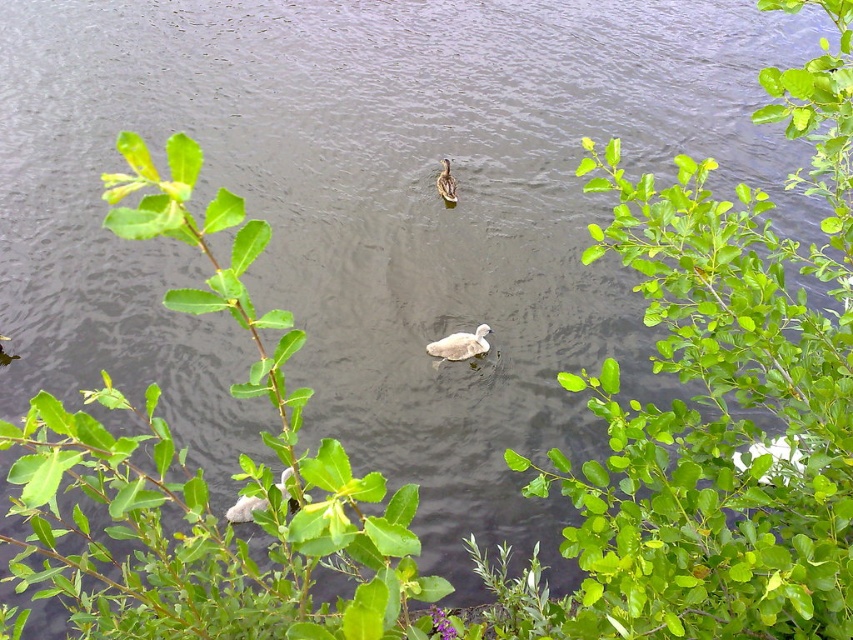
You are standing at the edge of the lake and want to place a small decorative rock exactly at the center of the green leafy plant at center. According to the coordinates provided, where should you place the rock?

The green leafy plant at center is located at point [204,480], so you should place the rock at those coordinates to position it exactly at the center of the plant.

You are a photographer trying to capture a closeup of the white fluffy swan at center without the green leafy plant at center blocking the view. Based on their sizes, can you position yourself in a way that the swan is fully visible without the plant overlapping?

The green leafy plant at center is wider than the white fluffy swan at center. To avoid the plant blocking the view, position yourself so that the swan is centered and the plant is to the side, ensuring the narrower swan fits within the frame without overlapping the wider plant.

You are a photographer trying to capture both the white fluffy swan at center and the brown feathered duck at center in a single shot. Based on their positions, which bird will appear larger in the photo?

The white fluffy swan at center will appear larger in the photo because it is closer to the camera than the brown feathered duck at center.